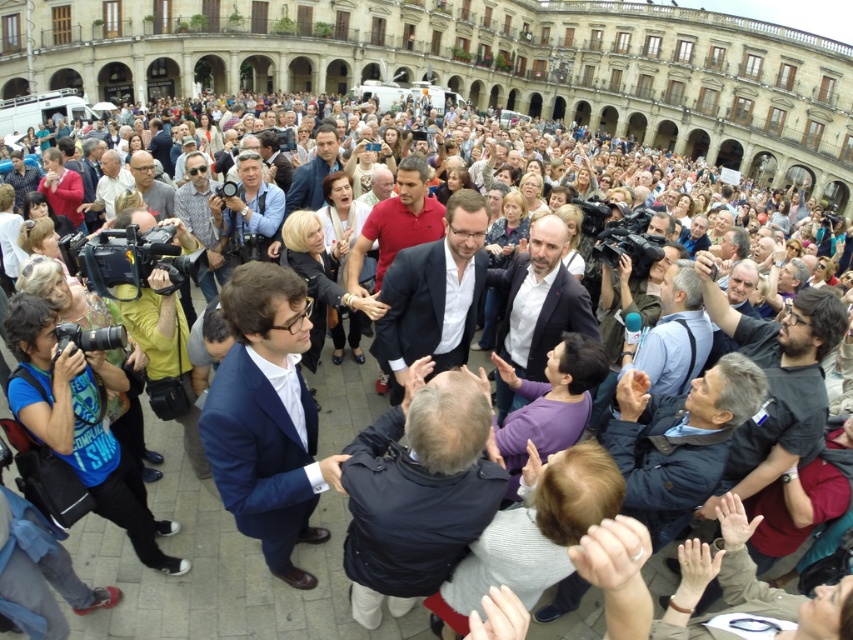
You are a photographer at the event and need to capture both the matte black suit at center and the matte red sweater at left in a single frame. Given their sizes, which one should you focus on to ensure both fit in the photo without cropping?

Since the matte black suit at center is wider than the matte red sweater at left, you should focus on the matte black suit at center to ensure both fit in the photo without cropping.

In the image of the public square event, there is a person wearing a matte gray shirt at center. If you were standing at the point marked as point (201,224), would you be standing on the same spot as the person wearing the matte gray shirt at center?

Yes, the point (201,224) represents the location of the matte gray shirt at center, so standing there would place you exactly where the person in the matte gray shirt is positioned.

You are a photographer at the event and need to capture both the matte red shirt at center and the matte red sweater at left in a single frame. Which one should you position on the left side of your camera viewfinder to ensure both are visible?

To ensure both the matte red shirt at center and the matte red sweater at left are visible, position the matte red sweater at left on the left side of your camera viewfinder since it is already located to the left of the matte red shirt at center.